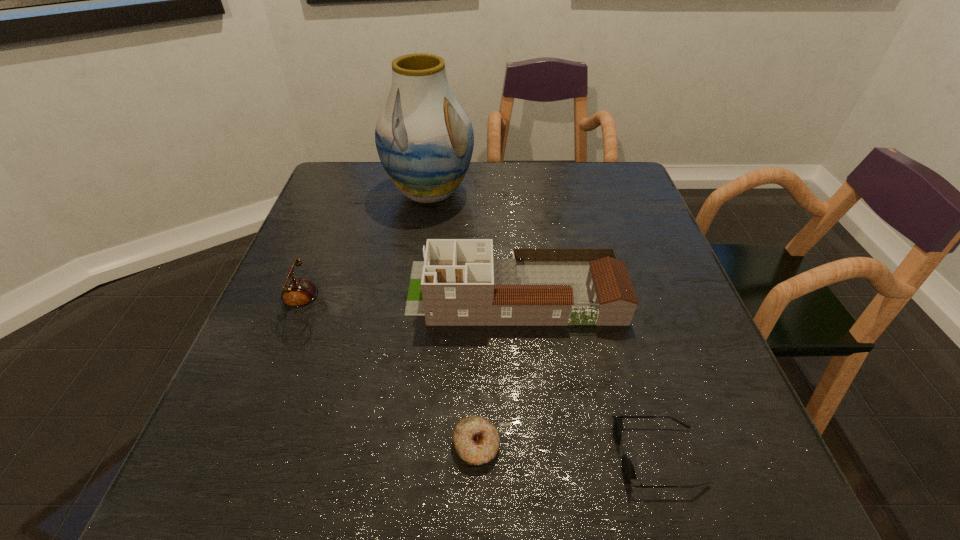
Image resolution: width=960 pixels, height=540 pixels. Identify the location of vacant region between the leftmost object and the farthest object. pos(365,252).

You are a GUI agent. You are given a task and a screenshot of the screen. Output one action in this format:
    pyautogui.click(x=<x>, y=<y>)
    Task: Click on the unoccupied position between the telephone and the farthest object
    
    Given the screenshot: What is the action you would take?
    (x=365, y=252)

Where is `free space between the shortest object and the fourth tallest object`? Image resolution: width=960 pixels, height=540 pixels. free space between the shortest object and the fourth tallest object is located at coordinates (567, 450).

Identify the location of free space between the doughnut and the fourth shortest object. This screenshot has width=960, height=540. (495, 368).

Image resolution: width=960 pixels, height=540 pixels. I want to click on free space between the third shortest object and the doughnut, so click(389, 377).

Find the location of a particular element. vacant area between the shortest object and the third shortest object is located at coordinates (389, 377).

Locate which object ranks third in proximity to the tallest object. Please provide its 2D coordinates. Your answer should be formatted as a tuple, i.e. [(x, y)], where the tuple contains the x and y coordinates of a point satisfying the conditions above.

[(476, 440)]

The width and height of the screenshot is (960, 540). Identify the location of object that is the second closest to the tallest object. (297, 293).